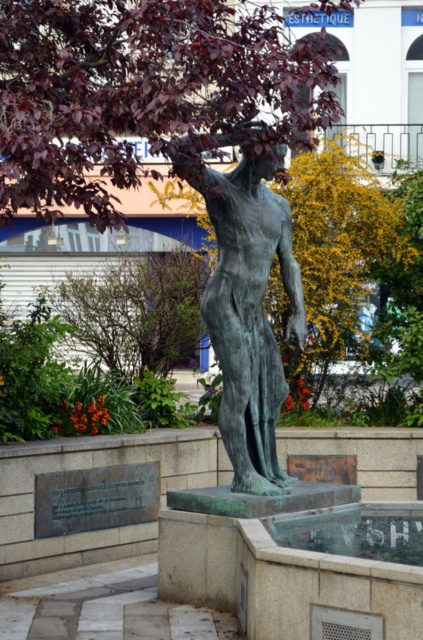
The image size is (423, 640). What do you see at coordinates (145, 93) in the screenshot?
I see `dark red leafy tree at upper left` at bounding box center [145, 93].

You are a GUI agent. You are given a task and a screenshot of the screen. Output one action in this format:
    pyautogui.click(x=<x>, y=<y>)
    Task: Click on the dark red leafy tree at upper left
    
    Given the screenshot: What is the action you would take?
    pyautogui.click(x=145, y=93)

Where is `dark red leafy tree at upper left`? Image resolution: width=423 pixels, height=640 pixels. dark red leafy tree at upper left is located at coordinates (145, 93).